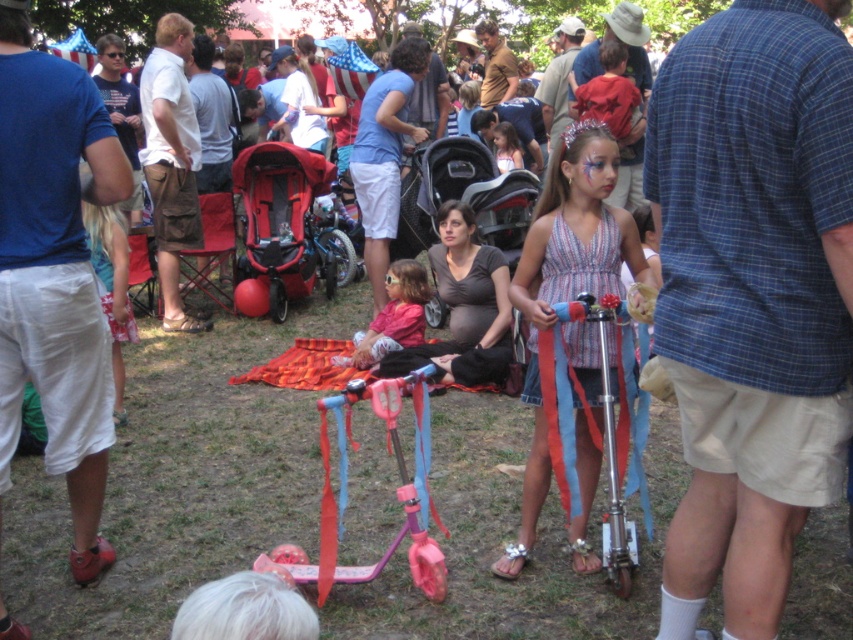
How much distance is there between striped fabric dress at center and pink plastic scooter at center?

They are 22.21 inches apart.

Which is more to the left, striped fabric dress at center or pink plastic scooter at center?

pink plastic scooter at center

Is point (590, 556) positioned behind point (422, 385)?

Yes, it is behind point (422, 385).

Identify the location of striped fabric dress at center. The width and height of the screenshot is (853, 640). (566, 280).

Is striped fabric dress at center further to the viewer compared to red fabric stroller at center?

No.

Is point (532, 272) less distant than point (267, 161)?

Yes, it is in front of point (267, 161).

This screenshot has height=640, width=853. I want to click on striped fabric dress at center, so point(566,280).

Is pink plastic scooter at center below matte pink scooter at center?

Correct, pink plastic scooter at center is located below matte pink scooter at center.

Does pink plastic scooter at center have a smaller size compared to matte pink scooter at center?

No.

In order to click on pink plastic scooter at center in this screenshot , I will do click(x=397, y=490).

Where is `pink plastic scooter at center`? This screenshot has width=853, height=640. pink plastic scooter at center is located at coordinates (397, 490).